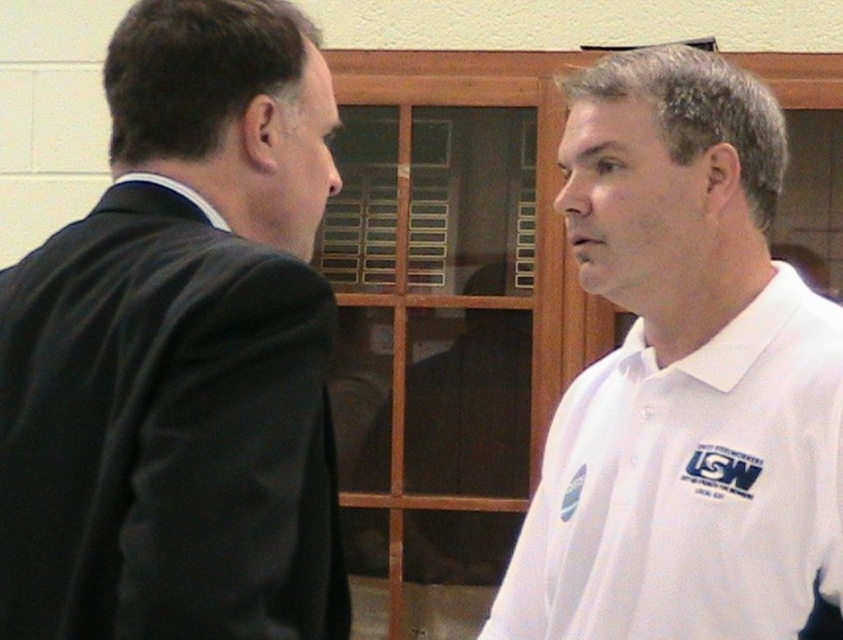
Which of these two, black suit at left or white cotton polo shirt at right, stands taller?

With more height is black suit at left.

Find the location of a particular element. black suit at left is located at coordinates [181, 353].